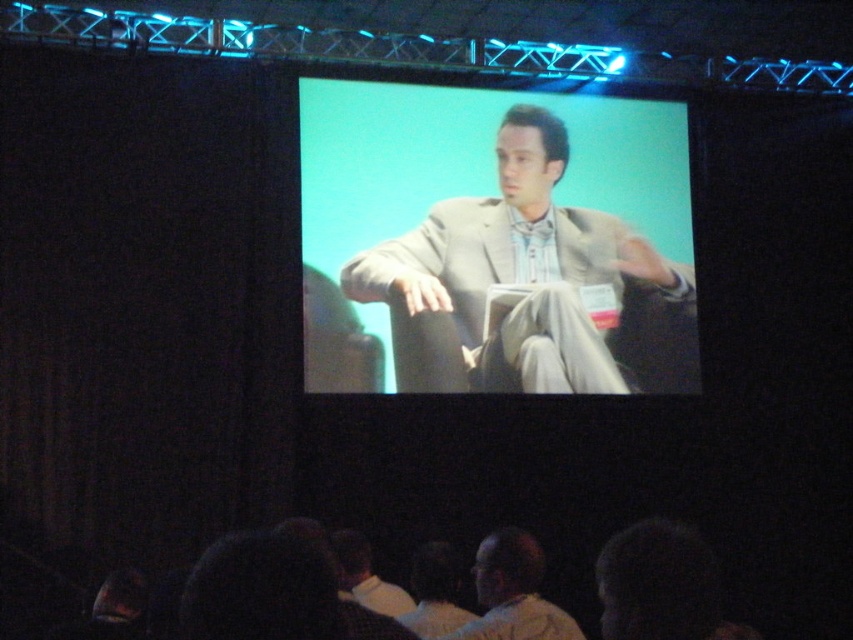
You are a photographer standing at the back of the conference room. You want to take a clear photo of the light beige suit at center. Considering the distance, is it possible to capture a sharp image without moving closer?

The light beige suit at center is 8.97 meters away from the camera. With proper focus and a high quality lens, it is possible to capture a sharp image without moving closer.